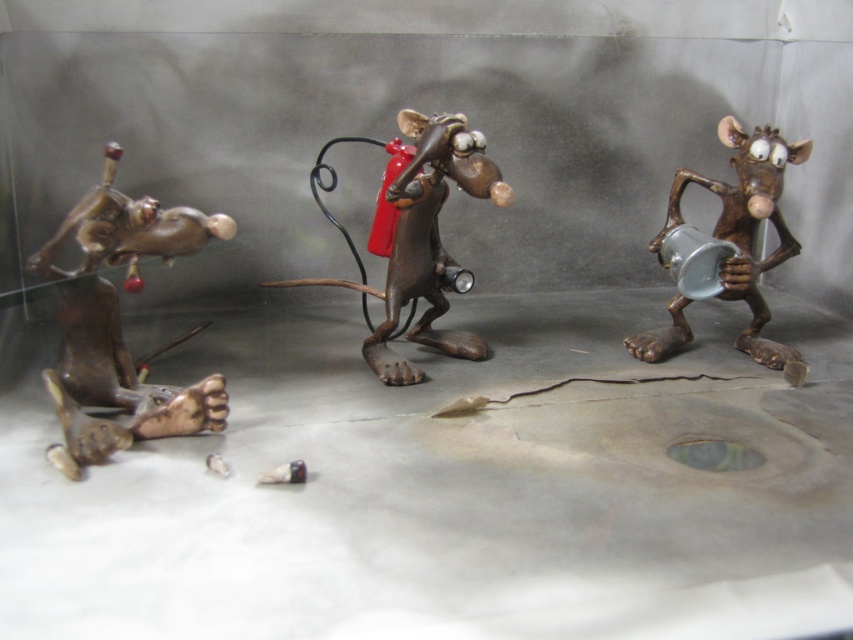
You are an art curator examining the glass case with the three mice figurines. You notice two points marked in the image at coordinates point (61, 307) and point (434, 196). From your vantage point, which point is closer to you?

Point (61, 307) is in front of point (434, 196), so it is closer to you.